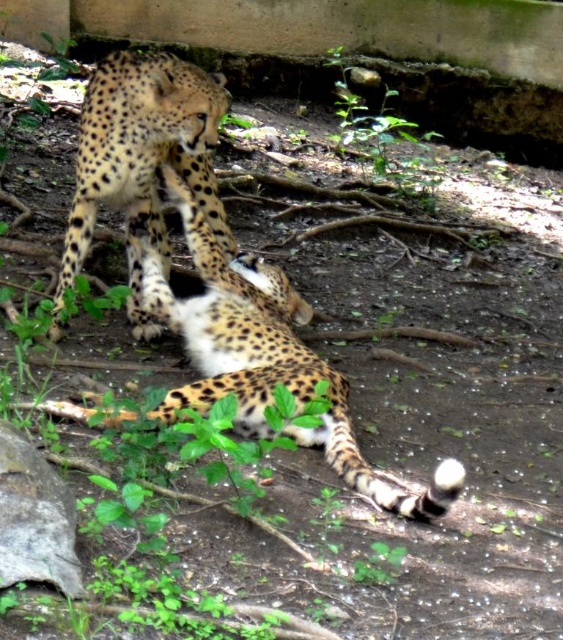
Does spotted fur cheetah at center come behind spotted fur cheetah at upper center?

No, spotted fur cheetah at center is in front of spotted fur cheetah at upper center.

Looking at this image, does spotted fur cheetah at center have a lesser width compared to spotted fur cheetah at upper center?

In fact, spotted fur cheetah at center might be wider than spotted fur cheetah at upper center.

Is point (443, 486) farther from viewer compared to point (81, 259)?

That is False.

The width and height of the screenshot is (563, 640). What are the coordinates of `spotted fur cheetah at center` in the screenshot? It's located at (276, 374).